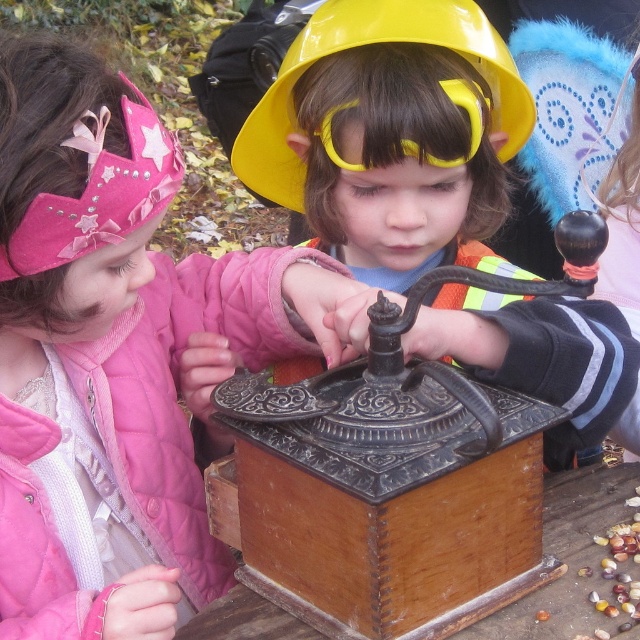
You are a photographer at the event and need to capture a photo where both the pink quilted jacket at left and the yellow matte safety goggles at center are clearly visible. Based on their positions, which object should you ensure is in the foreground to avoid it being obscured?

The pink quilted jacket at left is positioned under the yellow matte safety goggles at center, so you should ensure the yellow matte safety goggles at center is in the foreground to avoid the pink quilted jacket at left from being obscured.

You are standing at the point marked by coordinates point (x=369, y=44). Looking around, you see the yellow hard hat at center. Which direction should you face to see the pink crown adorned with stars and rhinestones?

The pink crown adorned with stars and rhinestones is located to the left of the yellow hard hat at center, so you should face left to see it.

You are a photographer trying to capture both the pink quilted jacket at left and the yellow matte safety goggles at center in a single frame. Based on their heights, which object should you adjust your camera angle to focus on first to ensure both are in the frame?

The pink quilted jacket at left is taller than the yellow matte safety goggles at center, so you should focus on the pink quilted jacket at left first to ensure both are in the frame.